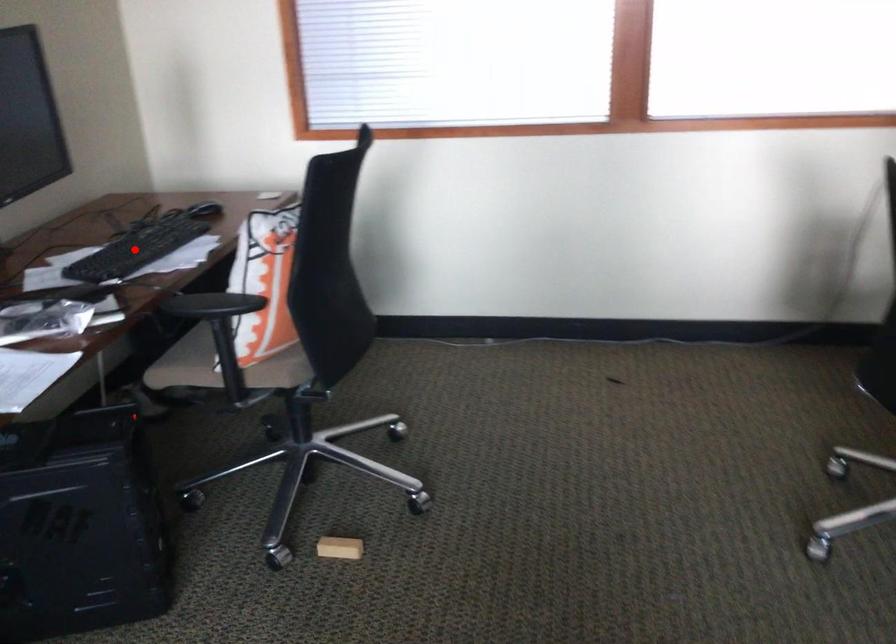
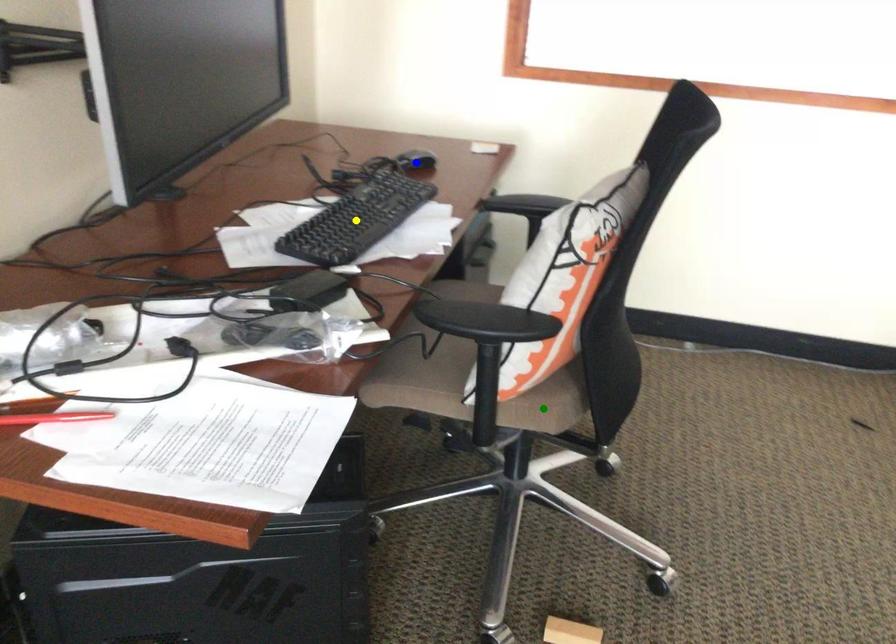
Question: I am providing you with two images of the same scene from different viewpoints. A red point is marked on the first image. You are given multiple points on the second image. Can you choose the point in image 2 that corresponds to the point in image 1?

Choices:
 (A) green point
 (B) blue point
 (C) yellow point

Answer: (C)